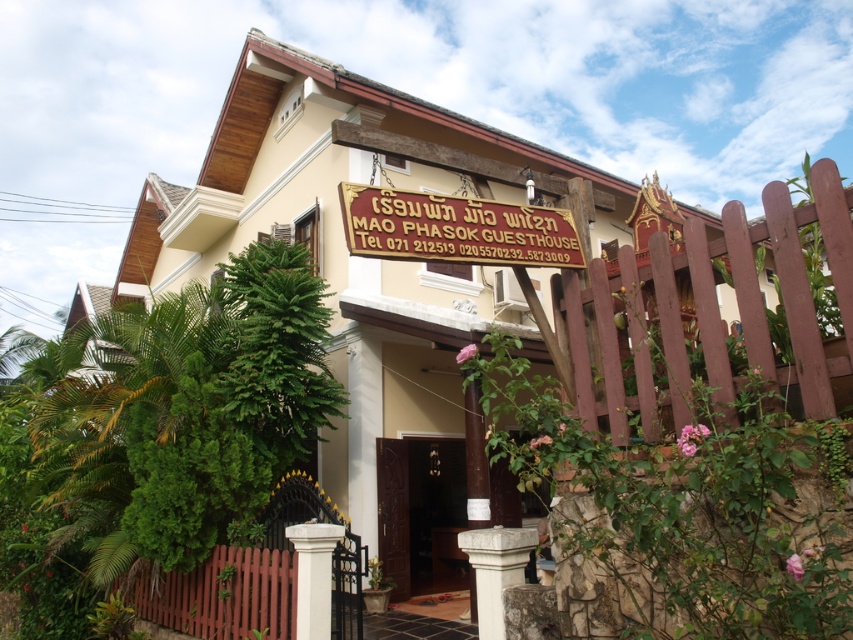
Question: Among these objects, which one is farthest from the camera?

Choices:
 (A) dark wood door at center
 (B) brown wooden fence at right
 (C) gold wood signboard at center

Answer: (A)

Question: Can you confirm if gold wood signboard at center is positioned to the right of dark wood door at center?

Choices:
 (A) no
 (B) yes

Answer: (B)

Question: Does gold wood signboard at center appear on the right side of dark wood door at center?

Choices:
 (A) yes
 (B) no

Answer: (A)

Question: Is brown wooden fence at right below gold wood signboard at center?

Choices:
 (A) no
 (B) yes

Answer: (B)

Question: Which point is closer to the camera?

Choices:
 (A) brown wooden fence at right
 (B) dark wood door at center
 (C) gold wood signboard at center
 (D) brown wooden fence at lower left

Answer: (A)

Question: Which of the following is the farthest from the observer?

Choices:
 (A) (494, 259)
 (B) (622, 413)
 (C) (189, 579)
 (D) (408, 524)

Answer: (D)